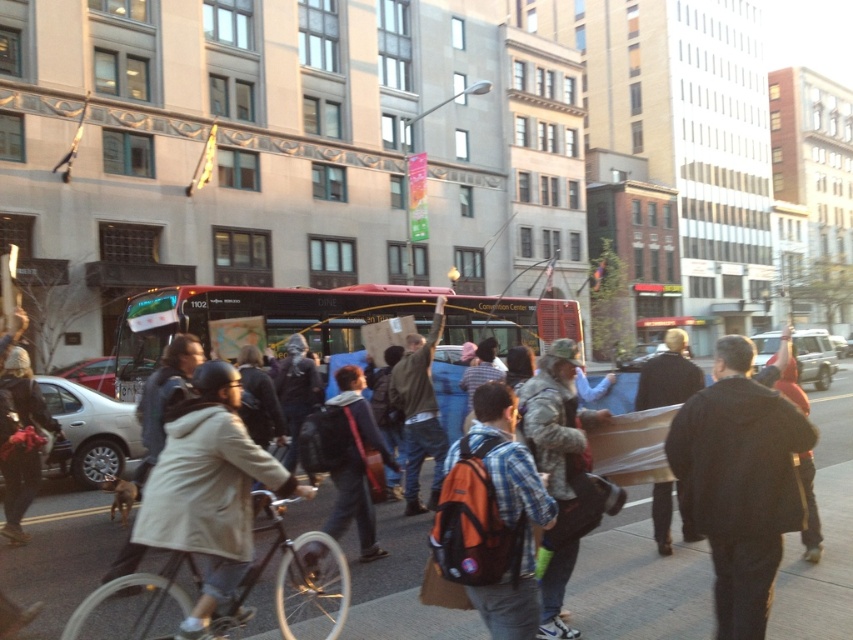
Which is in front, point (78, 403) or point (663, 486)?

Point (663, 486) is more forward.

Which is above, silver metallic sedan at left or dark gray jacket at center?

dark gray jacket at center is above.

Does point (65, 388) come closer to viewer compared to point (656, 388)?

No, it is not.

Identify the location of silver metallic sedan at left. 90,429.

Is black leather jacket at center smaller than dark blue backpack at center?

Incorrect, black leather jacket at center is not smaller in size than dark blue backpack at center.

Measure the distance between black leather jacket at center and camera.

A distance of 3.28 meters exists between black leather jacket at center and camera.

Between point (704, 419) and point (347, 448), which one is positioned behind?

Point (347, 448)

Image resolution: width=853 pixels, height=640 pixels. What are the coordinates of `black leather jacket at center` in the screenshot? It's located at (740, 483).

Which is above, black leather jacket at center or dark brown leather jacket at right?

dark brown leather jacket at right is higher up.

Between point (704, 531) and point (814, 504), which one is positioned in front?

Positioned in front is point (704, 531).

Does point (741, 387) lie in front of point (813, 525)?

Yes, point (741, 387) is closer to viewer.

The height and width of the screenshot is (640, 853). Find the location of `black leather jacket at center`. black leather jacket at center is located at coordinates (740, 483).